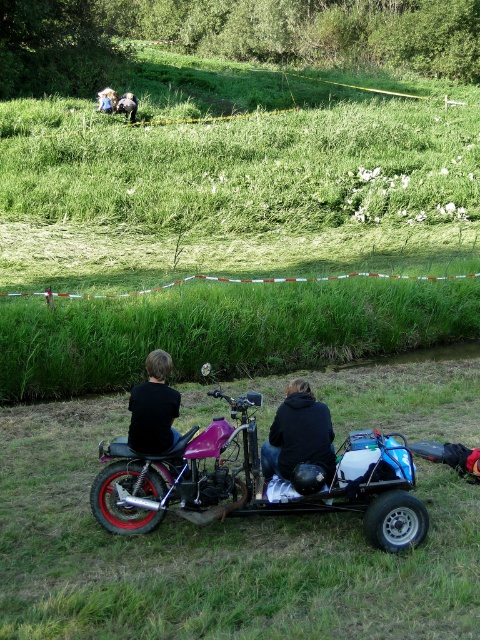
You are planning to transport the shiny purple motorcycle at center and the black matte jacket at center through a narrow pathway that is only 1.2 meters wide. Based on their sizes, will both items fit side by side without overlapping?

The shiny purple motorcycle at center is wider than the black matte jacket at center. Since the pathway is only 1.2 meters wide, it is uncertain if both can fit side by side without overlapping without knowing their exact widths.

You are a photographer trying to capture the vehicle and its riders from a low angle. Based on the scene, will the green grass at lower center block your view of the black matte jacket at center?

The green grass at lower center is shorter than the black matte jacket at center, so it will not block the view of the black matte jacket at center.

You are a photographer trying to capture a photo of the shiny purple motorcycle at center and the black matte jacket at center. To ensure both are in frame, which object should you position closer to the camera?

The shiny purple motorcycle at center is positioned on the left side of the black matte jacket at center. Therefore, to ensure both are in frame, you should position the shiny purple motorcycle at center closer to the camera so that it aligns with the black matte jacket at center.